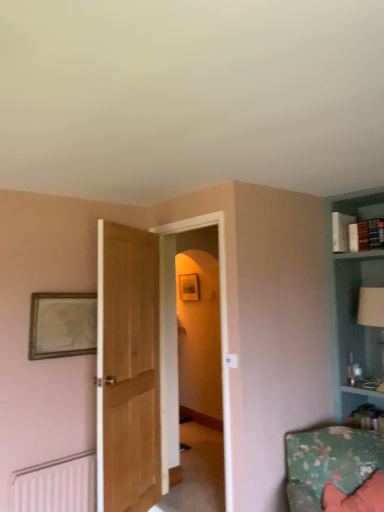
Question: From the image's perspective, is floral fabric cushion at lower right above or below wooden picture frame at upper left?

Choices:
 (A) below
 (B) above

Answer: (A)

Question: Is floral fabric cushion at lower right spatially inside wooden picture frame at upper left, or outside of it?

Choices:
 (A) outside
 (B) inside

Answer: (A)

Question: Which is farther from the floral fabric cushion at lower right?

Choices:
 (A) wooden picture frame at upper left
 (B) white glossy table lamp at upper right
 (C) light brown wood door at center
 (D) white matte radiator at lower left
 (E) transparent glass door at center

Answer: (A)

Question: Estimate the real-world distances between objects in this image. Which object is closer to the transparent glass door at center?

Choices:
 (A) white matte radiator at lower left
 (B) light brown wood door at center
 (C) white glossy table lamp at upper right
 (D) floral fabric cushion at lower right
 (E) wooden picture frame at upper left

Answer: (B)